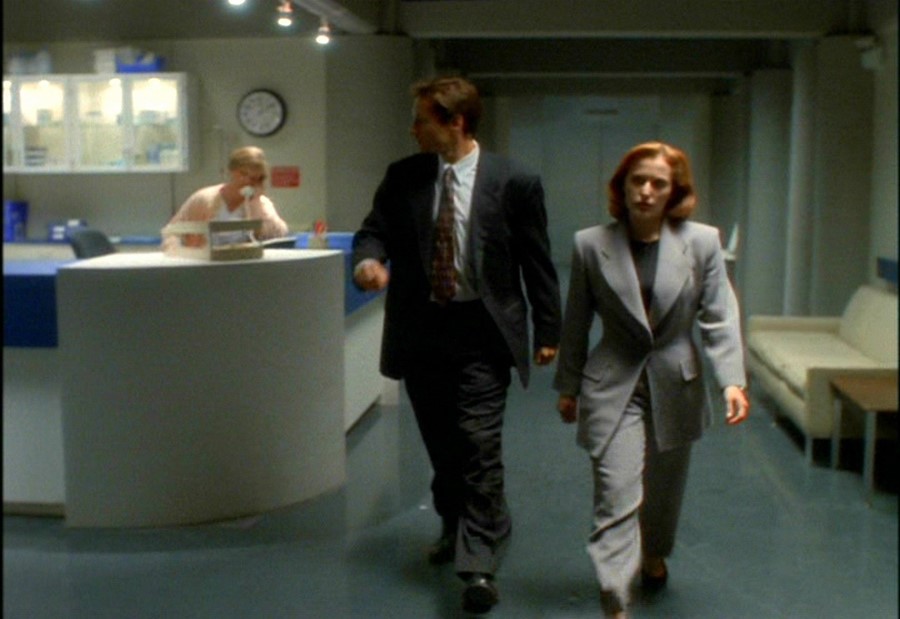
In order to click on gray floors in this screenshot , I will do pos(774,539).